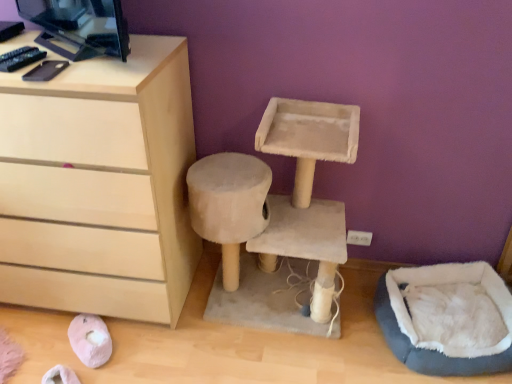
Question: Does light wood chest of drawers at left appear on the left side of blue fuzzy bean bag at lower right?

Choices:
 (A) no
 (B) yes

Answer: (B)

Question: Considering the relative sizes of light wood chest of drawers at left and blue fuzzy bean bag at lower right in the image provided, is light wood chest of drawers at left shorter than blue fuzzy bean bag at lower right?

Choices:
 (A) no
 (B) yes

Answer: (A)

Question: From the image's perspective, is light wood chest of drawers at left located beneath blue fuzzy bean bag at lower right?

Choices:
 (A) no
 (B) yes

Answer: (A)

Question: From a real-world perspective, is light wood chest of drawers at left beneath blue fuzzy bean bag at lower right?

Choices:
 (A) yes
 (B) no

Answer: (B)

Question: Is light wood chest of drawers at left thinner than blue fuzzy bean bag at lower right?

Choices:
 (A) no
 (B) yes

Answer: (A)

Question: Is light wood chest of drawers at left to the right of blue fuzzy bean bag at lower right from the viewer's perspective?

Choices:
 (A) no
 (B) yes

Answer: (A)

Question: Can you confirm if blue fuzzy bean bag at lower right is taller than beige fabric cat tree at center?

Choices:
 (A) no
 (B) yes

Answer: (A)

Question: From a real-world perspective, is blue fuzzy bean bag at lower right on beige fabric cat tree at center?

Choices:
 (A) yes
 (B) no

Answer: (B)

Question: Is blue fuzzy bean bag at lower right in front of beige fabric cat tree at center?

Choices:
 (A) yes
 (B) no

Answer: (B)

Question: From the image's perspective, is blue fuzzy bean bag at lower right beneath beige fabric cat tree at center?

Choices:
 (A) no
 (B) yes

Answer: (B)

Question: Is blue fuzzy bean bag at lower right wider than beige fabric cat tree at center?

Choices:
 (A) yes
 (B) no

Answer: (A)

Question: Does blue fuzzy bean bag at lower right have a lesser height compared to beige fabric cat tree at center?

Choices:
 (A) yes
 (B) no

Answer: (A)

Question: Is light wood chest of drawers at left thinner than black glossy desktop computer at upper left?

Choices:
 (A) yes
 (B) no

Answer: (B)